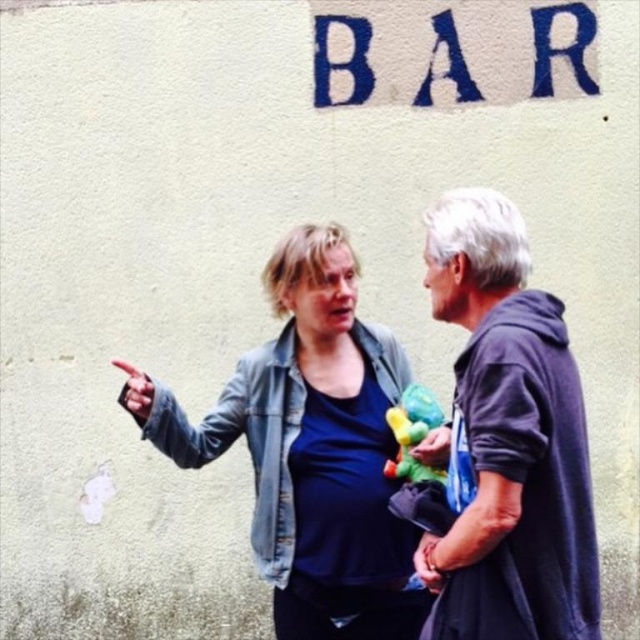
Does dark gray hoodie at right have a larger size compared to multicolored plush toy at center?

Correct, dark gray hoodie at right is larger in size than multicolored plush toy at center.

Can you confirm if dark gray hoodie at right is shorter than multicolored plush toy at center?

No, dark gray hoodie at right is not shorter than multicolored plush toy at center.

Is point (515, 298) in front of point (410, 387)?

Yes, it is in front of point (410, 387).

In order to click on dark gray hoodie at right in this screenshot , I will do `click(509, 435)`.

Does denim jacket at upper left have a lesser width compared to dark gray hoodie at right?

No.

Does denim jacket at upper left have a lesser height compared to dark gray hoodie at right?

No.

Which is behind, point (376, 509) or point (422, 552)?

Positioned behind is point (376, 509).

Where is `denim jacket at upper left`? Image resolution: width=640 pixels, height=640 pixels. denim jacket at upper left is located at coordinates (310, 449).

Which is more to the left, denim jacket at upper left or multicolored plush toy at center?

denim jacket at upper left

At what (x,y) coordinates should I click in order to perform the action: click on denim jacket at upper left. Please return your answer as a coordinate pair (x, y). Looking at the image, I should click on (310, 449).

Locate an element on the screen. The height and width of the screenshot is (640, 640). denim jacket at upper left is located at coordinates (310, 449).